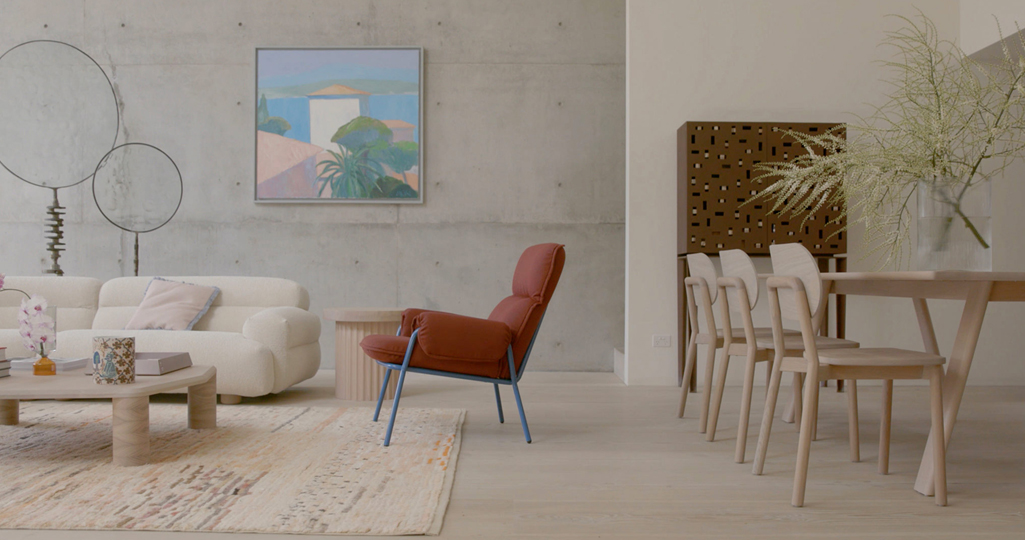
I want to click on places to sit, so click(452, 339), click(693, 267), click(740, 265), click(792, 266), click(261, 297).